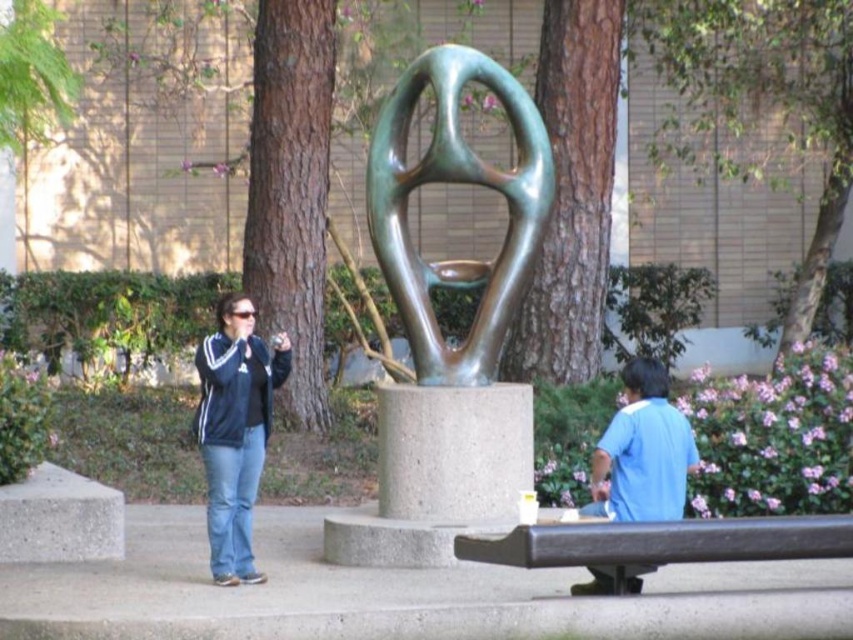
What is the spatial relationship between the black metal bench at lower right and the blue cotton shirt at lower right in the scene?

The black metal bench at lower right is positioned under the blue cotton shirt at lower right.